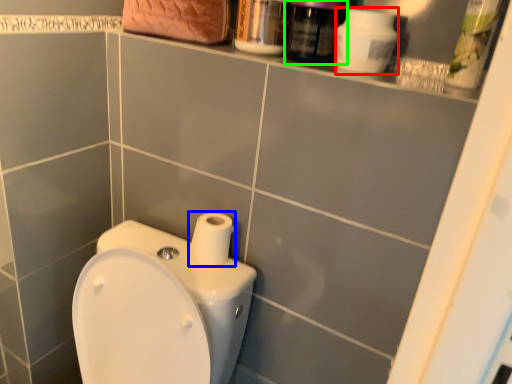
Question: Estimate the real-world distances between objects in this image. Which object is closer to cleaning product (highlighted by a red box), toilet paper (highlighted by a blue box) or mouthwash (highlighted by a green box)?

Choices:
 (A) toilet paper
 (B) mouthwash

Answer: (B)